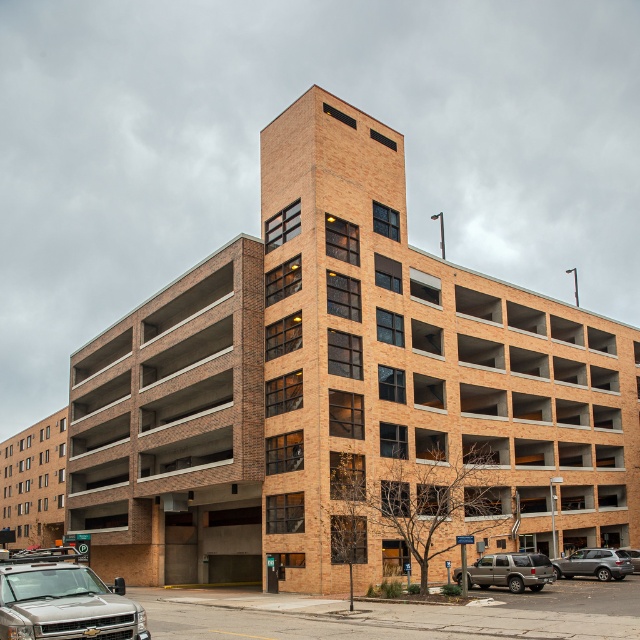
Locate an element on the screen. metallic silver suv at lower right is located at coordinates (512, 572).

Who is more distant from viewer, (x=534, y=554) or (x=596, y=554)?

The point (x=596, y=554) is behind.

In order to click on metallic silver suv at lower right in this screenshot , I will do `click(512, 572)`.

Is silver metallic suv at lower right wider than satin silver suv at lower right?

Incorrect, silver metallic suv at lower right's width does not surpass satin silver suv at lower right's.

Which is behind, point (602, 579) or point (625, 550)?

The point (625, 550) is behind.

Is point (556, 560) closer to viewer compared to point (632, 552)?

Yes, point (556, 560) is in front of point (632, 552).

The image size is (640, 640). Find the location of `silver metallic suv at lower right`. silver metallic suv at lower right is located at coordinates (595, 563).

Which of these two, silver metallic suv at lower left or satin silver suv at lower right, stands taller?

With more height is satin silver suv at lower right.

Is silver metallic suv at lower left bigger than satin silver suv at lower right?

Incorrect, silver metallic suv at lower left is not larger than satin silver suv at lower right.

This screenshot has height=640, width=640. What do you see at coordinates (64, 600) in the screenshot? I see `silver metallic suv at lower left` at bounding box center [64, 600].

Find the location of a particular element. silver metallic suv at lower left is located at coordinates (64, 600).